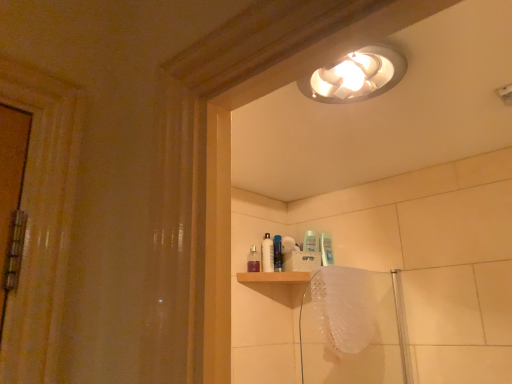
Question: Which direction should I rotate to look at white plastic bottle at center, the second toiletry when ordered from left to right, — up or down?

Choices:
 (A) down
 (B) up

Answer: (A)

Question: Is blue glossy bottle at center, which ranks as the third toiletry in left-to-right order, inside translucent plastic spray bottle at upper center, which is the first toiletry in left-to-right order?

Choices:
 (A) yes
 (B) no

Answer: (B)

Question: Is translucent plastic spray bottle at upper center, the third toiletry from the right, not within blue glossy bottle at center, which ranks as the third toiletry in left-to-right order?

Choices:
 (A) yes
 (B) no

Answer: (A)

Question: Is translucent plastic spray bottle at upper center, the third toiletry from the right, smaller than blue glossy bottle at center, which ranks as the third toiletry in left-to-right order?

Choices:
 (A) no
 (B) yes

Answer: (B)

Question: Is translucent plastic spray bottle at upper center, the third toiletry from the right, directly adjacent to blue glossy bottle at center, which ranks as the third toiletry in left-to-right order?

Choices:
 (A) yes
 (B) no

Answer: (B)

Question: Is translucent plastic spray bottle at upper center, which is the first toiletry in left-to-right order, to the left of blue glossy bottle at center, positioned as the 1th toiletry in right-to-left order, from the viewer's perspective?

Choices:
 (A) no
 (B) yes

Answer: (B)

Question: Is translucent plastic spray bottle at upper center, the third toiletry from the right, thinner than blue glossy bottle at center, which ranks as the third toiletry in left-to-right order?

Choices:
 (A) no
 (B) yes

Answer: (B)

Question: Is translucent plastic bath towel at lower right smaller than blue glossy bottle at center, which ranks as the third toiletry in left-to-right order?

Choices:
 (A) yes
 (B) no

Answer: (B)

Question: Is translucent plastic bath towel at lower right outside blue glossy bottle at center, positioned as the 1th toiletry in right-to-left order?

Choices:
 (A) yes
 (B) no

Answer: (A)

Question: Does translucent plastic bath towel at lower right lie behind blue glossy bottle at center, positioned as the 1th toiletry in right-to-left order?

Choices:
 (A) yes
 (B) no

Answer: (B)

Question: From a real-world perspective, does translucent plastic bath towel at lower right stand above blue glossy bottle at center, which ranks as the third toiletry in left-to-right order?

Choices:
 (A) yes
 (B) no

Answer: (B)

Question: Does translucent plastic bath towel at lower right lie in front of blue glossy bottle at center, which ranks as the third toiletry in left-to-right order?

Choices:
 (A) yes
 (B) no

Answer: (A)

Question: Is translucent plastic bath towel at lower right surrounding blue glossy bottle at center, positioned as the 1th toiletry in right-to-left order?

Choices:
 (A) no
 (B) yes

Answer: (A)

Question: Can you confirm if translucent plastic shower door at lower right is wider than translucent plastic bath towel at lower right?

Choices:
 (A) yes
 (B) no

Answer: (B)